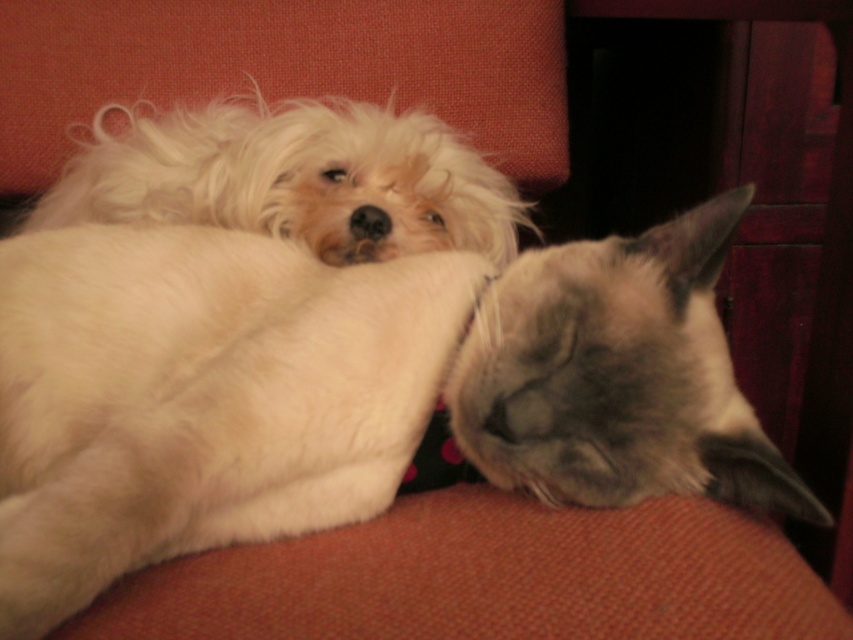
Question: Does silvery-gray fur cat at upper center appear under white fluffy dog at upper left?

Choices:
 (A) no
 (B) yes

Answer: (B)

Question: Estimate the real-world distances between objects in this image. Which object is farther from the silvery-gray fur cat at upper center?

Choices:
 (A) gray fur cat at center
 (B) white fluffy dog at upper left

Answer: (B)

Question: Does silvery-gray fur cat at upper center come in front of gray fur cat at center?

Choices:
 (A) yes
 (B) no

Answer: (A)

Question: Estimate the real-world distances between objects in this image. Which object is farther from the silvery-gray fur cat at upper center?

Choices:
 (A) gray fur cat at center
 (B) white fluffy dog at upper left

Answer: (B)

Question: Which of these objects is positioned farthest from the white fluffy dog at upper left?

Choices:
 (A) silvery-gray fur cat at upper center
 (B) gray fur cat at center

Answer: (B)

Question: Where is silvery-gray fur cat at upper center located in relation to gray fur cat at center in the image?

Choices:
 (A) right
 (B) left

Answer: (B)